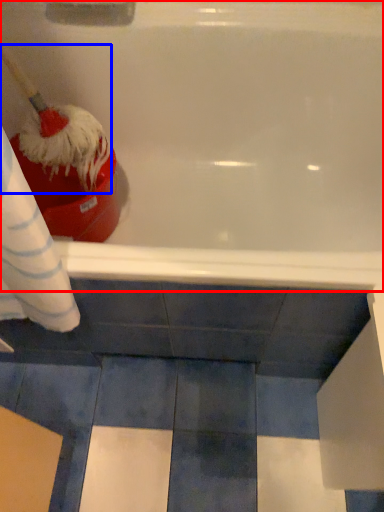
Question: Among these objects, which one is farthest to the camera, bathtub (highlighted by a red box) or brush (highlighted by a blue box)?

Choices:
 (A) bathtub
 (B) brush

Answer: (A)